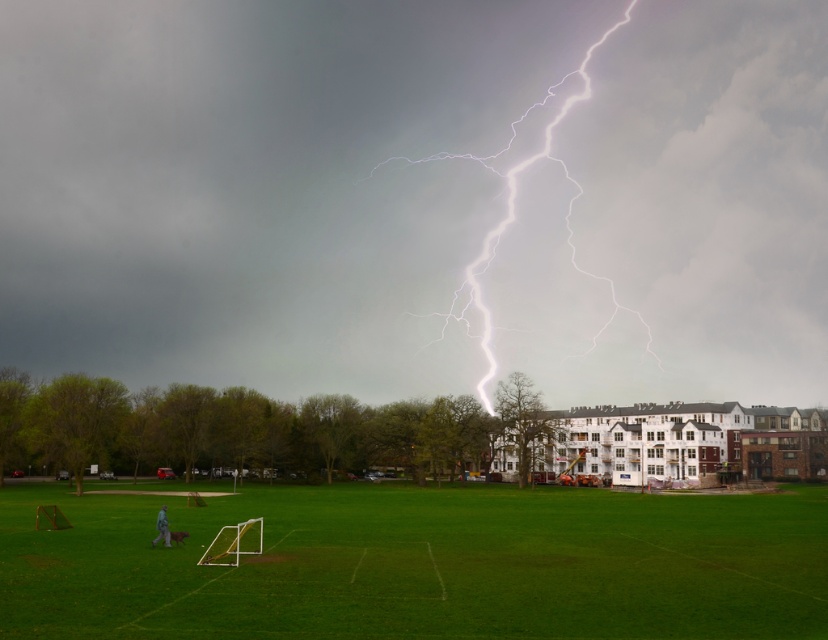
Can you confirm if bright white lightning at center is smaller than green grass field at lower center?

No.

From the picture: Who is shorter, bright white lightning at center or green grass field at lower center?

Standing shorter between the two is green grass field at lower center.

Is point (489, 289) in front of point (119, 497)?

No, it is not.

Where is `bright white lightning at center`? This screenshot has width=828, height=640. bright white lightning at center is located at coordinates pos(417,196).